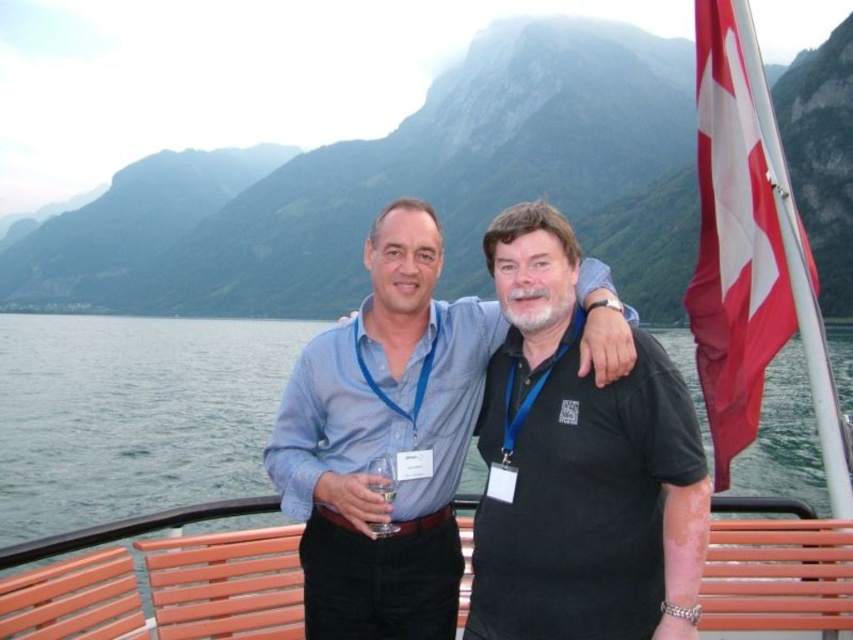
You are a photographer trying to capture a portrait of the black matte shirt at center. The scene has a point marked at coordinates [579,467]. Where should you position your camera to ensure the black matte shirt at center is centered in your shot?

The point at coordinates [579,467] corresponds to the black matte shirt at center, so positioning the camera directly facing that coordinate will center the black matte shirt at center in the shot.

You are standing on the boat deck and want to take a photo of the scenic mountain and lake view. The camera you are using has a focal length of 50mm and a sensor size of 24mm x 36mm. If you want to capture the entire scene including the point at coordinate point (x=675, y=460), which is 16.07 meters away from the camera, what is the minimum distance you should step back to ensure the entire view fits within the frame?

Result: To determine the minimum distance to step back, first calculate the field of view using the focal length and sensor size. The vertical field of view is 2 arctan, so the required distance would be the point distance divided by the tangent of half the vertical FOV. However, without knowing the exact height of the scene or the position of the point within the frame, an exact calculation isn

You are a drone operator tasked with capturing aerial footage of the scene. The black matte shirt at center is your primary subject, and you need to ensure the transparent water at bench left remains in the frame. Given the distance between them, what is the minimum horizontal field of view required for your camera to capture both subjects simultaneously?

The minimum horizontal field of view required for the camera is at least 111.23 meters to ensure both the black matte shirt at center and the transparent water at bench left are in the frame.